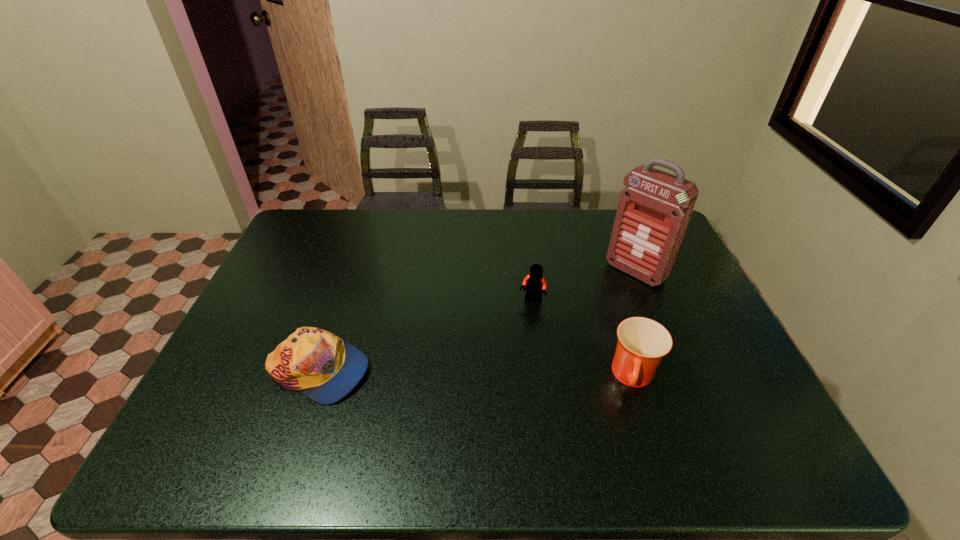
Point out which object is positioned as the nearest to the cap. Please provide its 2D coordinates. Your answer should be formatted as a tuple, i.e. [(x, y)], where the tuple contains the x and y coordinates of a point satisfying the conditions above.

[(535, 284)]

I want to click on object that ranks as the third closest to the leftmost object, so point(653,212).

Locate an element on the screen. The image size is (960, 540). blank space that satisfies the following two spatial constraints: 1. on the back side of the second farthest object; 2. on the left side of the first-aid kit is located at coordinates (528, 272).

Find the location of `blank area in the image that satisfies the following two spatial constraints: 1. on the front side of the cup; 2. on the right side of the Lego`. blank area in the image that satisfies the following two spatial constraints: 1. on the front side of the cup; 2. on the right side of the Lego is located at coordinates (541, 378).

At what (x,y) coordinates should I click in order to perform the action: click on vacant region that satisfies the following two spatial constraints: 1. on the front side of the Lego; 2. on the left side of the cup. Please return your answer as a coordinate pair (x, y). The height and width of the screenshot is (540, 960). Looking at the image, I should click on (541, 378).